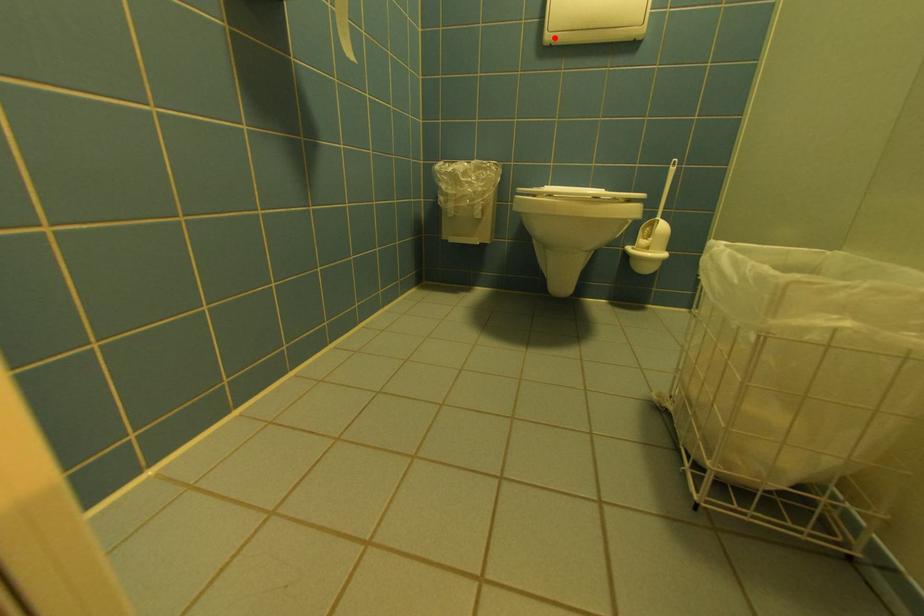
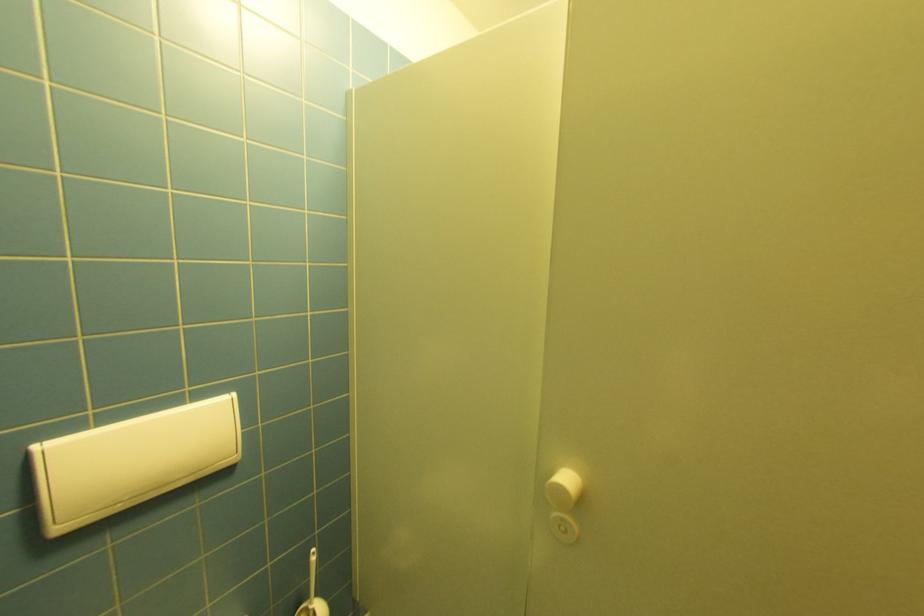
Locate, in the second image, the point that corresponds to the highlighted location in the first image.

(66, 530)